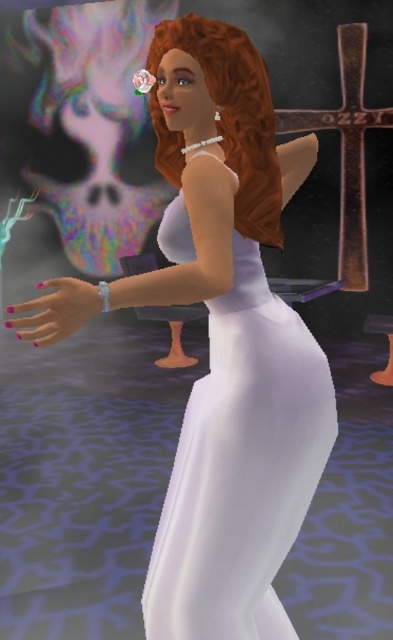
Question: Which of the following is the closest to the observer?

Choices:
 (A) (x=242, y=230)
 (B) (x=260, y=410)

Answer: (B)

Question: Is satin white dress at center bigger than curly auburn hair at center?

Choices:
 (A) yes
 (B) no

Answer: (A)

Question: Can you confirm if satin white dress at center is wider than curly auburn hair at center?

Choices:
 (A) yes
 (B) no

Answer: (A)

Question: Does satin white dress at center come behind curly auburn hair at center?

Choices:
 (A) no
 (B) yes

Answer: (A)